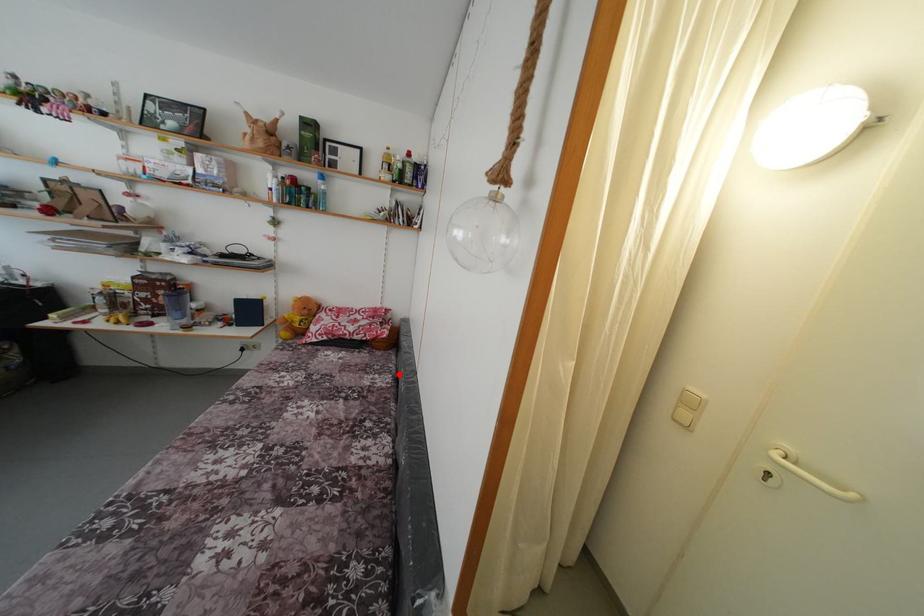
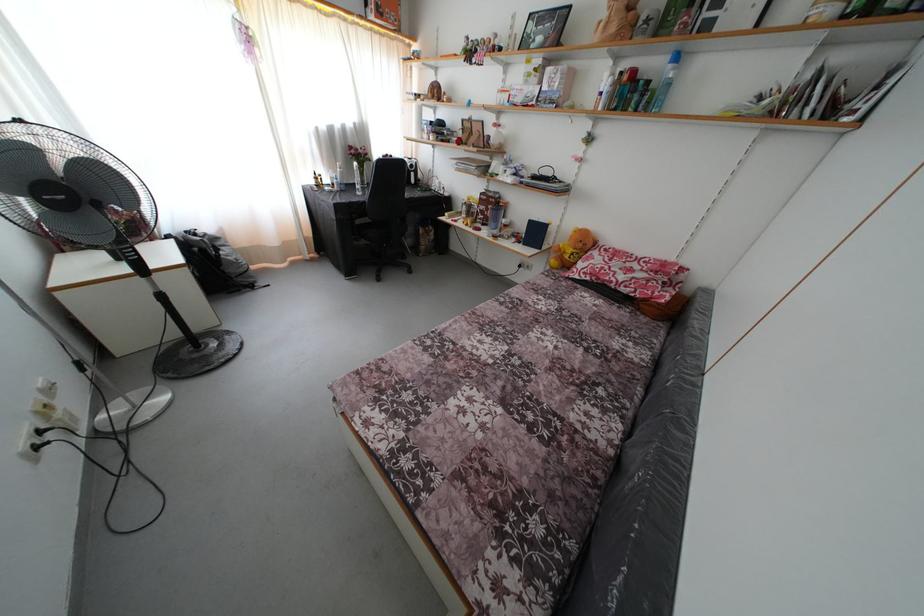
In the second image, find the point that corresponds to the highlighted location in the first image.

(663, 353)